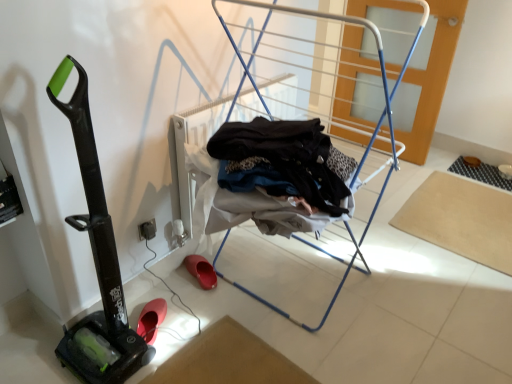
You are a GUI agent. You are given a task and a screenshot of the screen. Output one action in this format:
    pyautogui.click(x=<x>, y=<y>)
    Task: Click on the free space in front of metallic blue drying rack at center
    This screenshot has width=512, height=384.
    Given the screenshot: What is the action you would take?
    pyautogui.click(x=297, y=353)